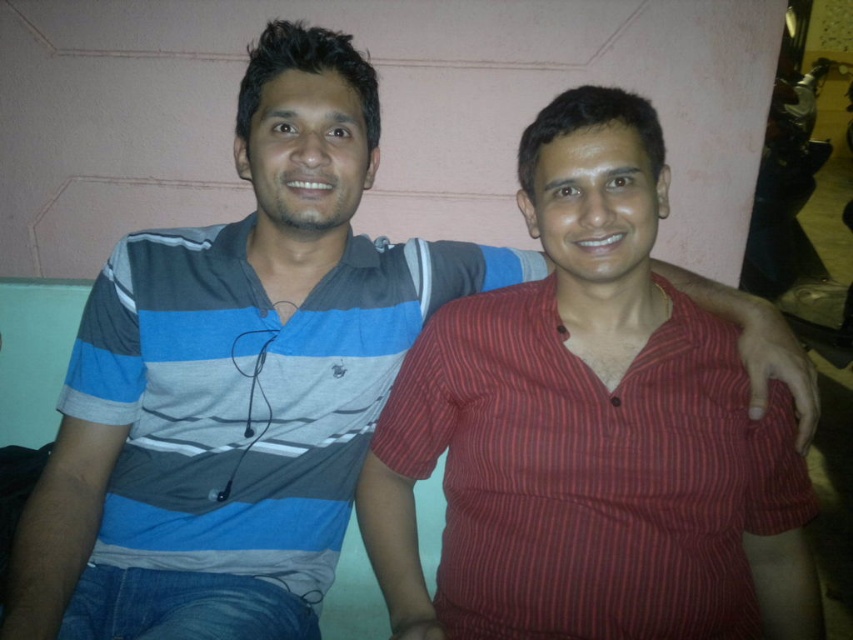
Question: Can you confirm if red striped shirt at center is smaller than striped cotton shirt at left?

Choices:
 (A) yes
 (B) no

Answer: (A)

Question: Which point is farther to the camera?

Choices:
 (A) (675, 563)
 (B) (213, 406)

Answer: (B)

Question: Among these objects, which one is nearest to the camera?

Choices:
 (A) red striped shirt at center
 (B) striped cotton shirt at left

Answer: (A)

Question: Can you confirm if red striped shirt at center is bigger than striped cotton shirt at left?

Choices:
 (A) yes
 (B) no

Answer: (B)

Question: Which of the following is the farthest from the observer?

Choices:
 (A) (344, 502)
 (B) (469, 490)

Answer: (A)

Question: Observing the image, what is the correct spatial positioning of red striped shirt at center in reference to striped cotton shirt at left?

Choices:
 (A) above
 (B) below

Answer: (B)